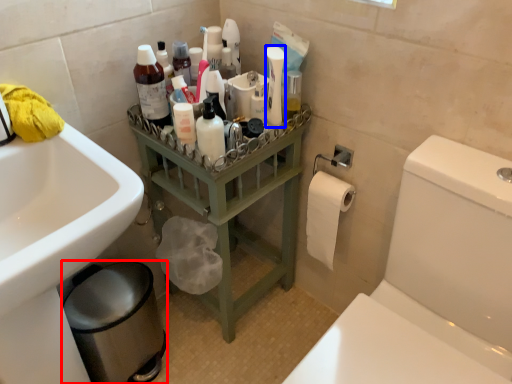
Question: Among these objects, which one is nearest to the camera, bidet (highlighted by a red box) or cleaning product (highlighted by a blue box)?

Choices:
 (A) bidet
 (B) cleaning product

Answer: (B)